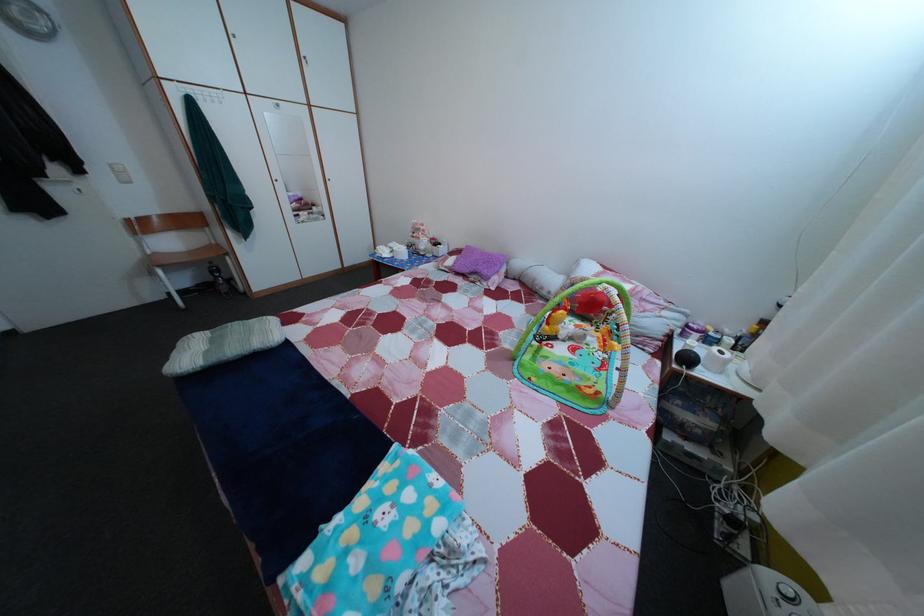
At what (x,y) coordinates should I click in order to perform the action: click on chair sitting surface. Please return your answer as a coordinate pair (x, y). Looking at the image, I should click on (176, 257).